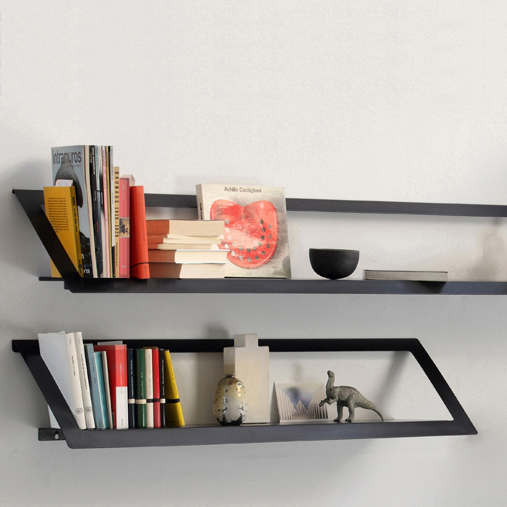
The image size is (507, 507). I want to click on magazines, so click(85, 166), click(91, 163), click(97, 175), click(101, 174), click(104, 183), click(108, 190), click(113, 181).